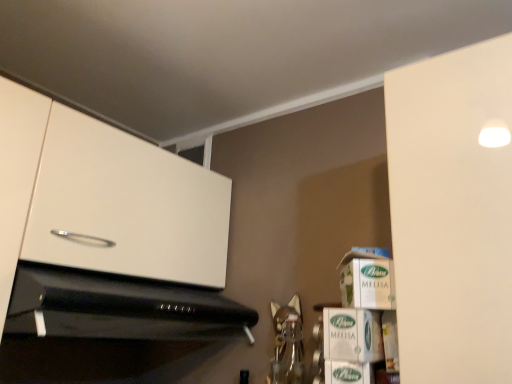
Question: From a real-world perspective, is white cardboard box at right, the third cardboard box positioned from the bottom, physically located above or below green cardboard box at lower right, marked as the 1th cardboard box in a bottom-to-top arrangement?

Choices:
 (A) below
 (B) above

Answer: (B)

Question: In terms of height, does white cardboard box at right, which is the 1th cardboard box from top to bottom, look taller or shorter compared to green cardboard box at lower right, marked as the 1th cardboard box in a bottom-to-top arrangement?

Choices:
 (A) short
 (B) tall

Answer: (B)

Question: Which of these objects is positioned farthest from the white cardboard box at lower right?

Choices:
 (A) black glossy microwave at lower left
 (B) white glossy cabinet at upper left
 (C) green cardboard box at lower right, positioned as the 2th cardboard box in bottom-to-top order
 (D) white cardboard box at right, the third cardboard box positioned from the bottom
 (E) green cardboard box at lower right, arranged as the third cardboard box when viewed from the top

Answer: (B)

Question: Estimate the real-world distances between objects in this image. Which object is closer to the white cardboard box at lower right?

Choices:
 (A) white cardboard box at right, the third cardboard box positioned from the bottom
 (B) white glossy cabinet at upper left
 (C) black glossy microwave at lower left
 (D) green cardboard box at lower right, the 2th cardboard box positioned from the top
 (E) green cardboard box at lower right, marked as the 1th cardboard box in a bottom-to-top arrangement

Answer: (D)